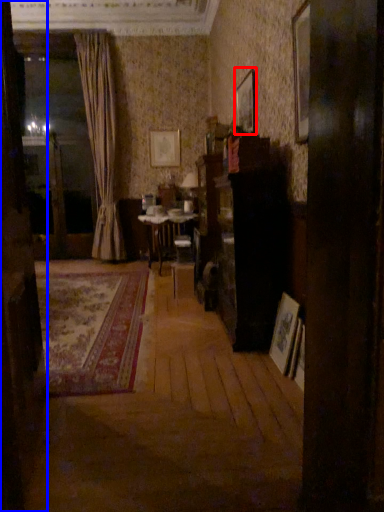
Question: Which object is further to the camera taking this photo, picture frame (highlighted by a red box) or door (highlighted by a blue box)?

Choices:
 (A) picture frame
 (B) door

Answer: (A)